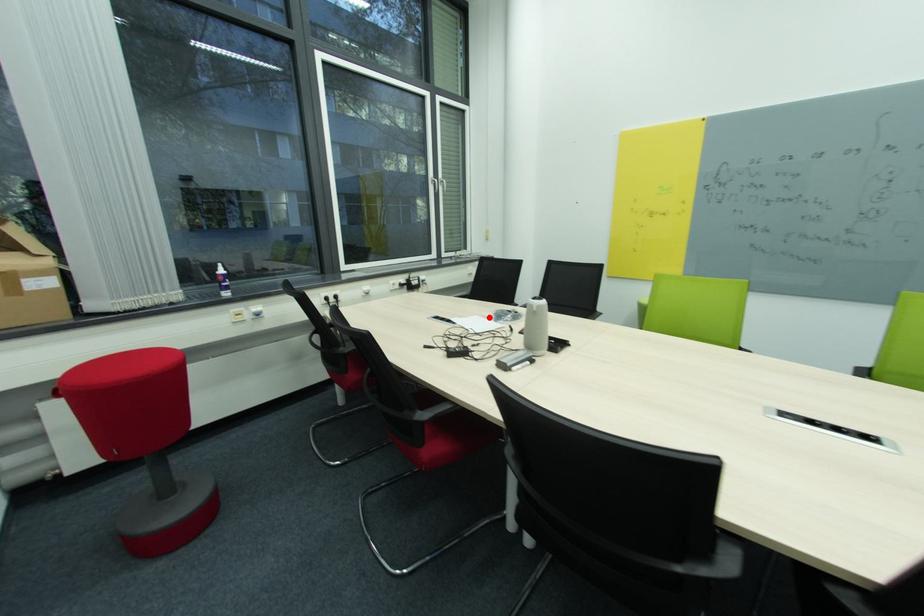
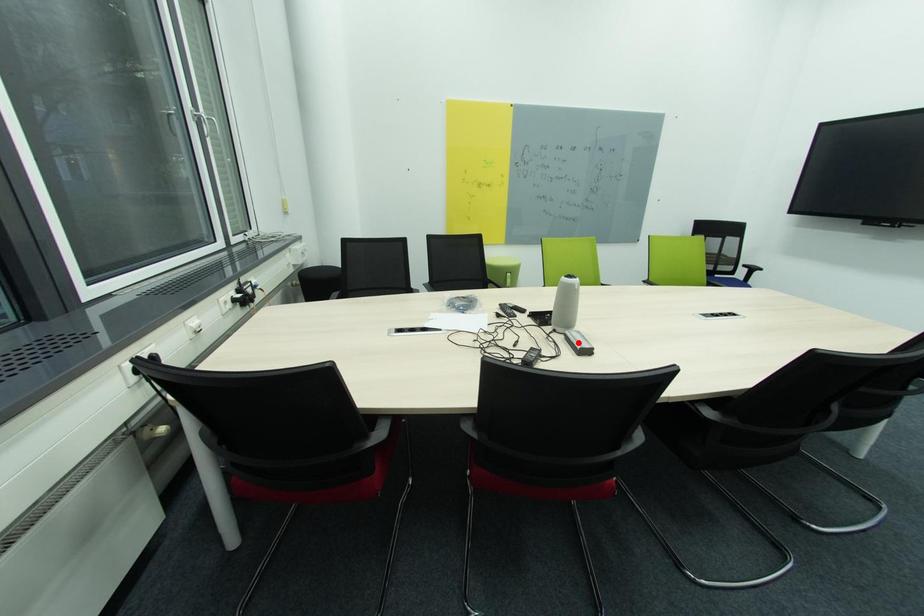
I am providing you with two images of the same scene from different viewpoints. A red point is marked on the first image and another point is marked on the second image. Does the point marked in image1 correspond to the same location as the one in image2?

No